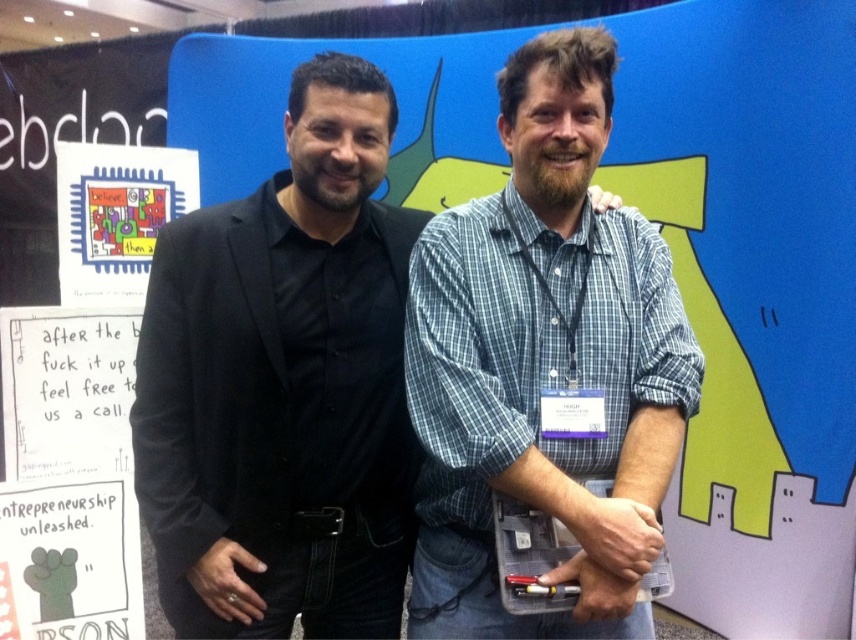
Can you confirm if black matte suit at left is bigger than blue plaid shirt at center?

Indeed, black matte suit at left has a larger size compared to blue plaid shirt at center.

Who is shorter, black matte suit at left or blue plaid shirt at center?

blue plaid shirt at center is shorter.

Is point (342, 336) closer to camera compared to point (617, 429)?

No, (342, 336) is behind (617, 429).

Where is `black matte suit at left`? This screenshot has width=856, height=640. black matte suit at left is located at coordinates (284, 385).